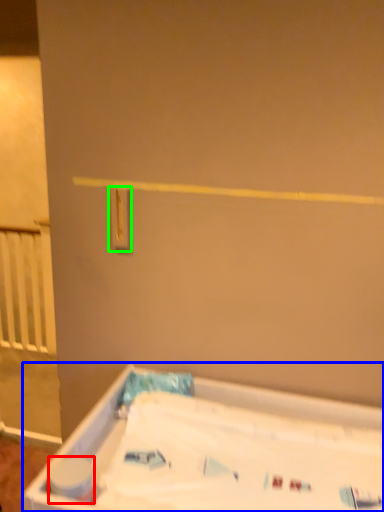
Question: Considering the real-world distances, which object is farthest from toilet paper (highlighted by a red box)? bathtub (highlighted by a blue box) or light switch (highlighted by a green box)?

Choices:
 (A) bathtub
 (B) light switch

Answer: (B)